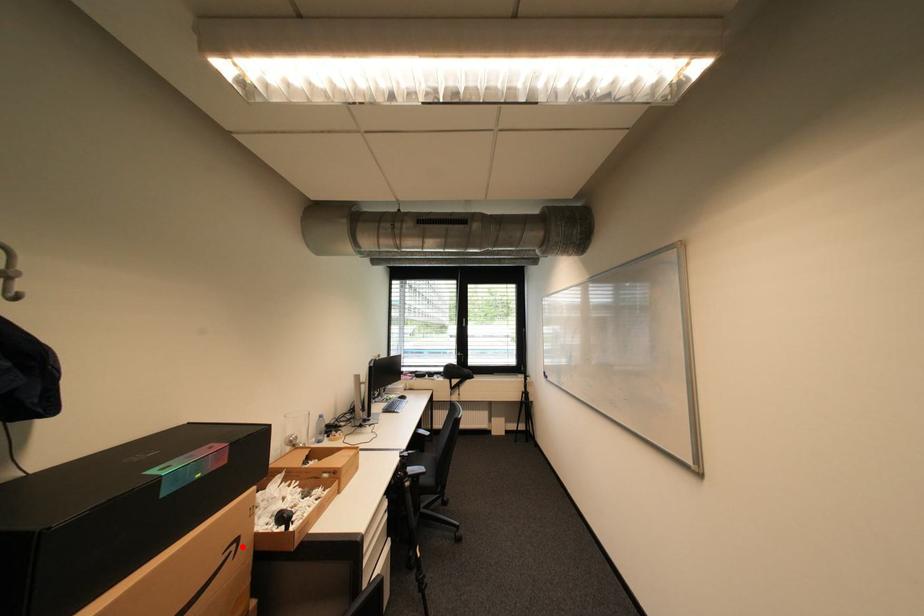
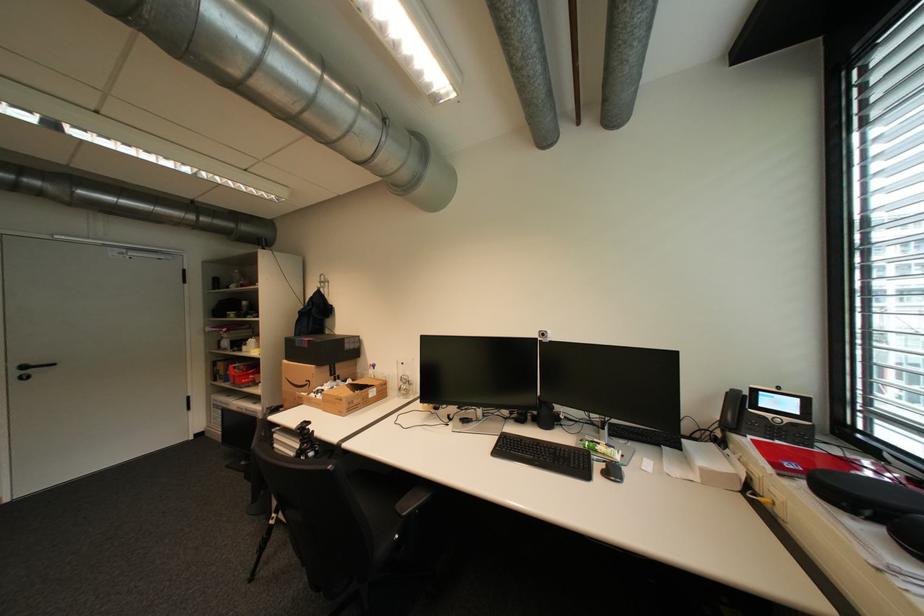
Find the pixel in the second image that matches the highlighted location in the first image.

(317, 383)